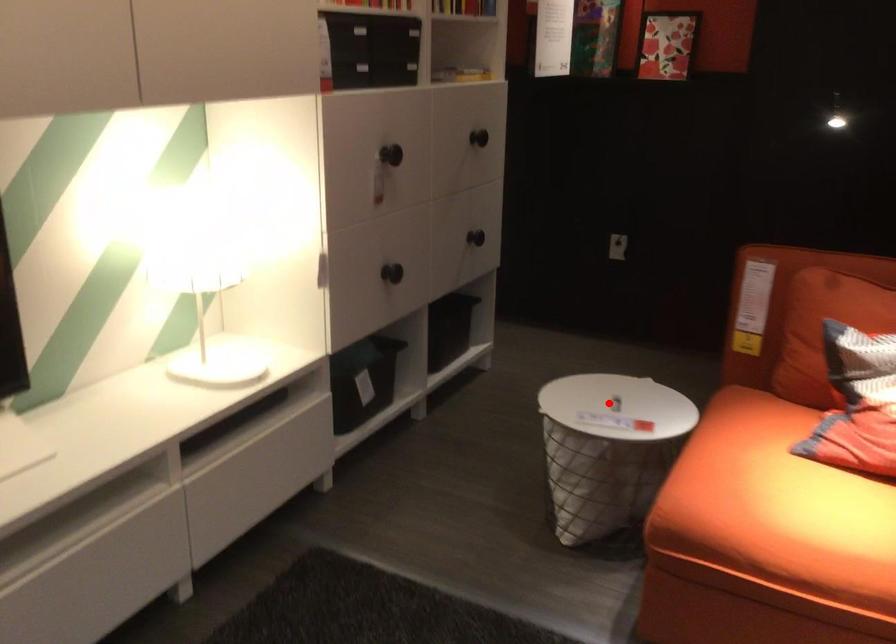
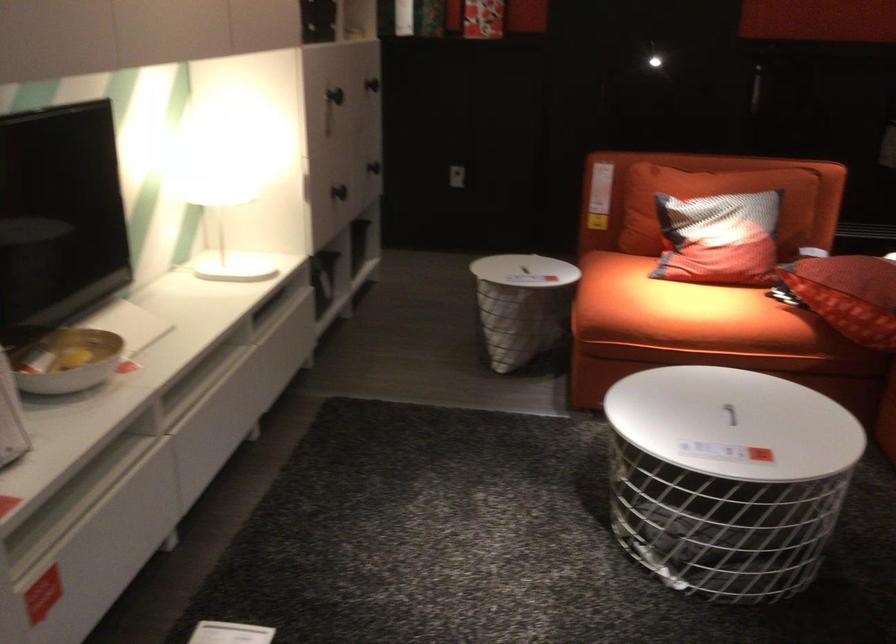
Find the pixel in the second image that matches the highlighted location in the first image.

(522, 270)